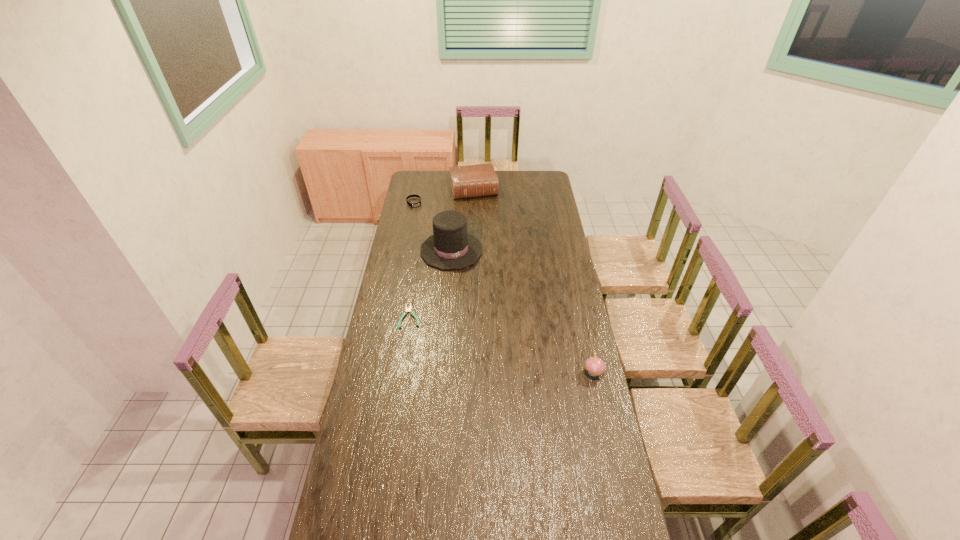
You are a GUI agent. You are given a task and a screenshot of the screen. Output one action in this format:
    pyautogui.click(x=<x>, y=<y>)
    Task: Click on the vacant space positioned 0.080m on the front of the third nearest object with the decoration
    Image resolution: width=960 pixels, height=540 pixels.
    Given the screenshot: What is the action you would take?
    pyautogui.click(x=464, y=280)

Locate an element on the screen. vacant position located on the front of the third nearest object with the decoration is located at coordinates (468, 288).

This screenshot has width=960, height=540. Identify the location of vacant space situated 0.210m on the front of the third nearest object with the decoration. (471, 298).

Find the location of a particular element. vacant point located 0.350m on the display of the wristband is located at coordinates (430, 241).

You are a GUI agent. You are given a task and a screenshot of the screen. Output one action in this format:
    pyautogui.click(x=<x>, y=<y>)
    Task: Click on the vacant space located on the display of the wristband
    The width and height of the screenshot is (960, 540).
    Given the screenshot: What is the action you would take?
    pyautogui.click(x=432, y=246)

Find the location of a particular element. The height and width of the screenshot is (540, 960). vacant space situated 0.390m on the display of the wristband is located at coordinates (432, 246).

Find the location of `blank area located 0.150m on the spine side of the Bible`. blank area located 0.150m on the spine side of the Bible is located at coordinates (482, 215).

Find the location of `vacant space located 0.160m on the spine side of the Bible`. vacant space located 0.160m on the spine side of the Bible is located at coordinates (482, 217).

You are a GUI agent. You are given a task and a screenshot of the screen. Output one action in this format:
    pyautogui.click(x=<x>, y=<y>)
    Task: Click on the free space located on the spine side of the Bible
    
    Given the screenshot: What is the action you would take?
    pyautogui.click(x=489, y=241)

Where is `object that is at the far edge`? object that is at the far edge is located at coordinates (471, 181).